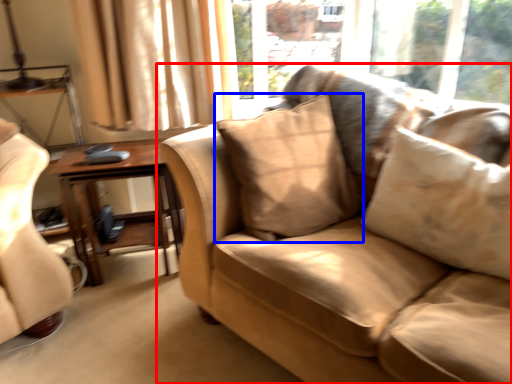
Question: Among these objects, which one is nearest to the camera, studio couch (highlighted by a red box) or pillow (highlighted by a blue box)?

Choices:
 (A) studio couch
 (B) pillow

Answer: (A)